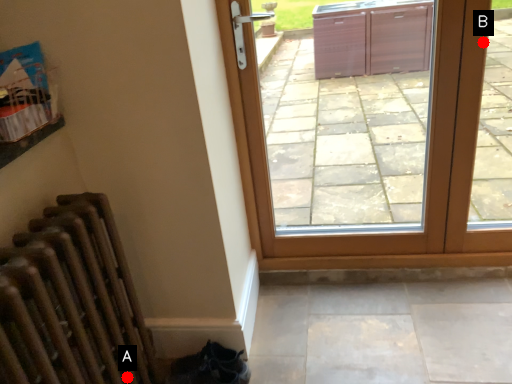
Question: Two points are circled on the image, labeled by A and B beside each circle. Which point is closer to the camera?

Choices:
 (A) A is closer
 (B) B is closer

Answer: (A)